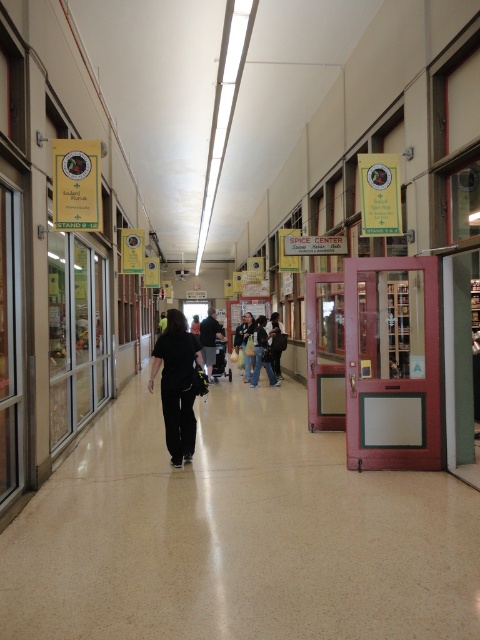
Question: Among these points, which one is farthest from the camera?

Choices:
 (A) (408, 572)
 (B) (166, 400)

Answer: (B)

Question: Can you confirm if brown speckled tile floor at center is thinner than black matte pants at center?

Choices:
 (A) yes
 (B) no

Answer: (B)

Question: Which of the following is the closest to the observer?

Choices:
 (A) brown speckled tile floor at center
 (B) black matte pants at center

Answer: (A)

Question: Is brown speckled tile floor at center above black matte pants at center?

Choices:
 (A) no
 (B) yes

Answer: (A)

Question: Does brown speckled tile floor at center lie in front of black matte pants at center?

Choices:
 (A) yes
 (B) no

Answer: (A)

Question: Which object is farther from the camera taking this photo?

Choices:
 (A) black matte pants at center
 (B) brown speckled tile floor at center

Answer: (A)